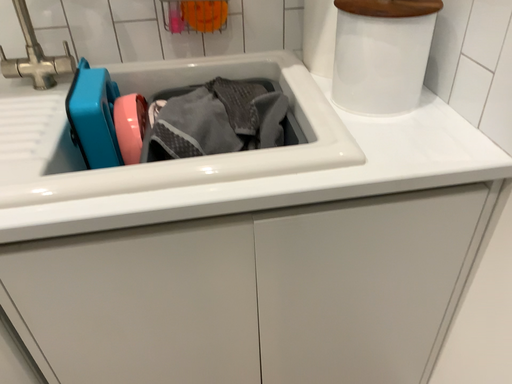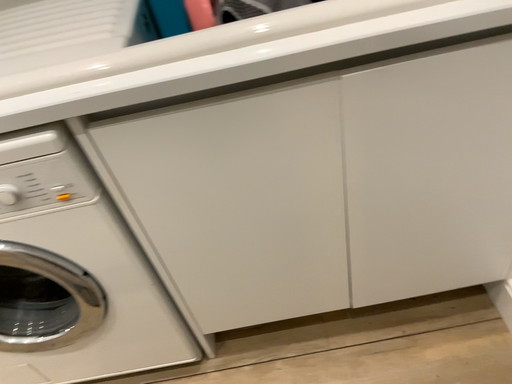
Question: Which way did the camera rotate in the video?

Choices:
 (A) rotated upward
 (B) rotated downward

Answer: (B)